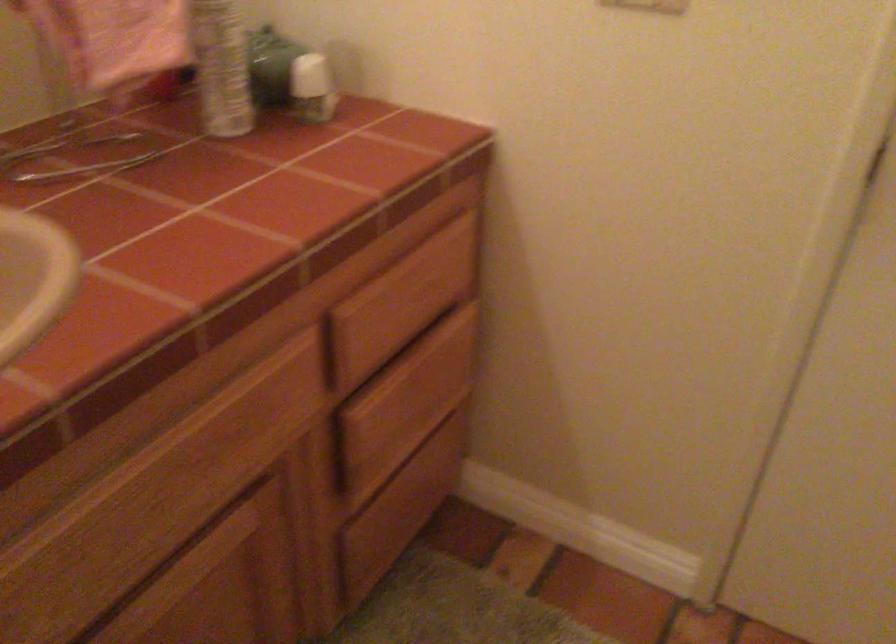
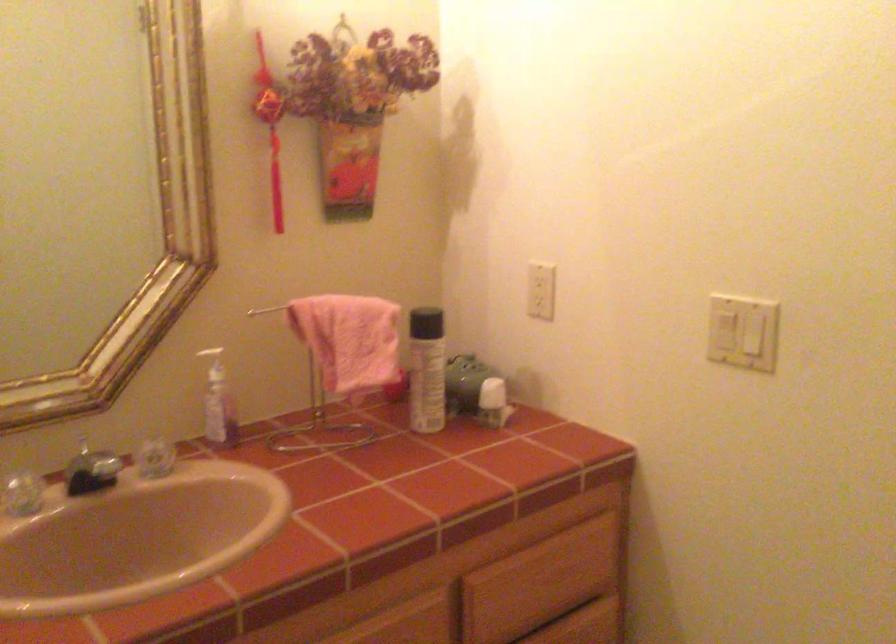
The images are taken continuously from a first-person perspective. In which direction is your viewpoint rotating?

The rotation direction of the camera is left-up.